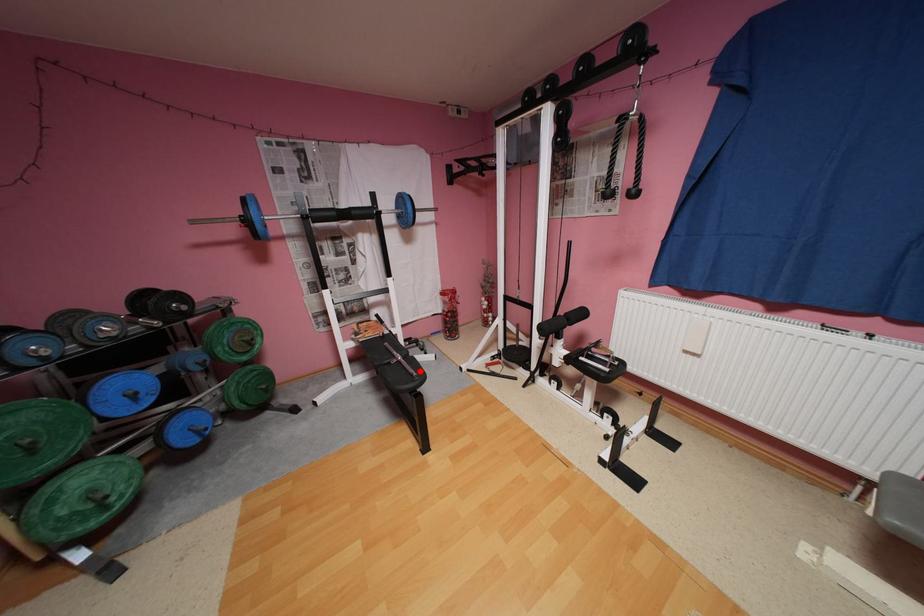
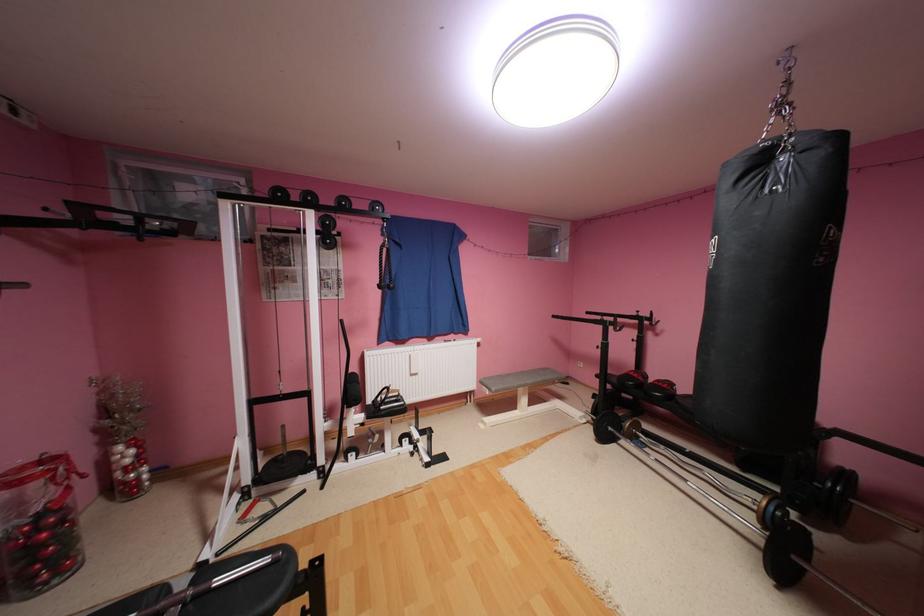
Question: I am providing you with two images of the same scene from different viewpoints. Given a red point in image1, look at the same physical point in image2. Is it:

Choices:
 (A) Closer to the viewpoint
 (B) Farther from the viewpoint

Answer: (B)